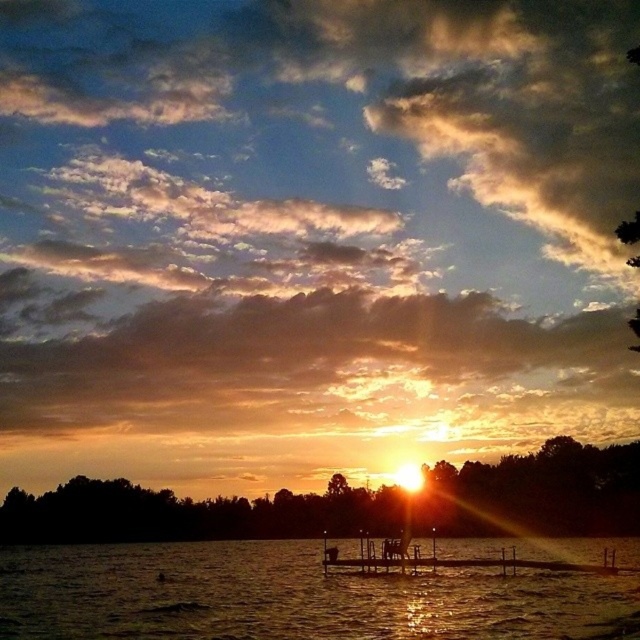
Who is higher up, shiny metallic water at lower center or brown wooden dock at center?

shiny metallic water at lower center is higher up.

Who is more forward, (236,611) or (502,566)?

Point (236,611)

Locate an element on the screen. shiny metallic water at lower center is located at coordinates (284, 596).